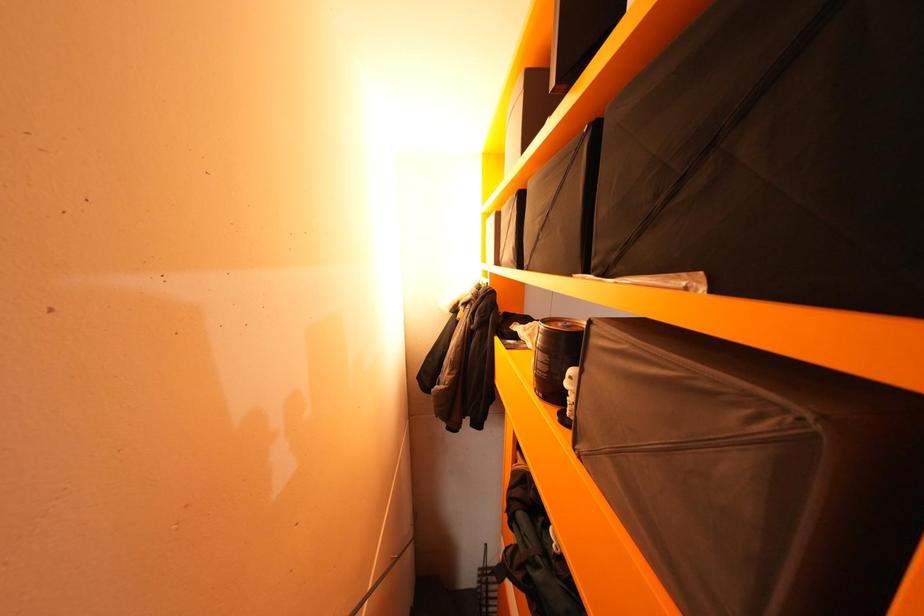
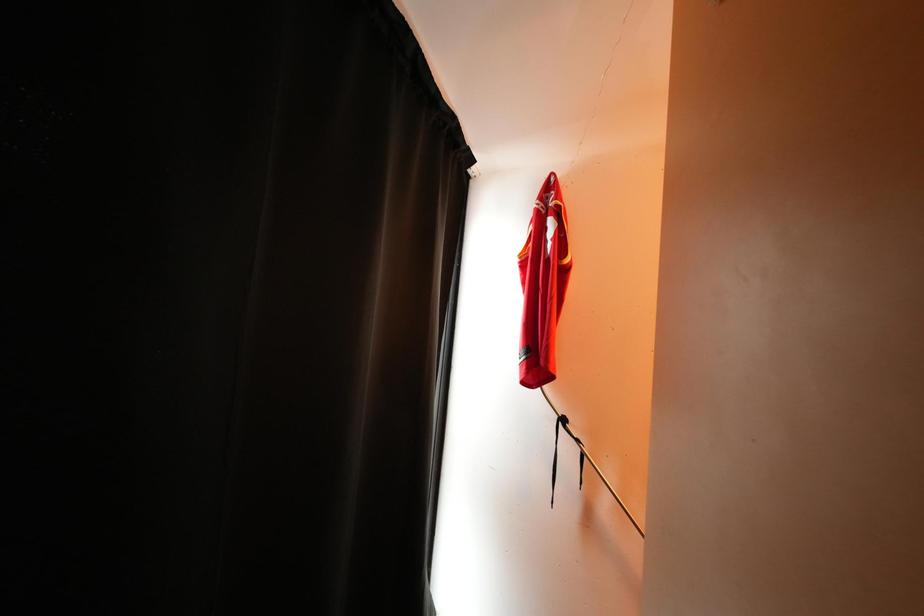
Question: The images are taken continuously from a first-person perspective. In which direction is your viewpoint rotating?

Choices:
 (A) Left
 (B) Right
 (C) Up
 (D) Down

Answer: (A)